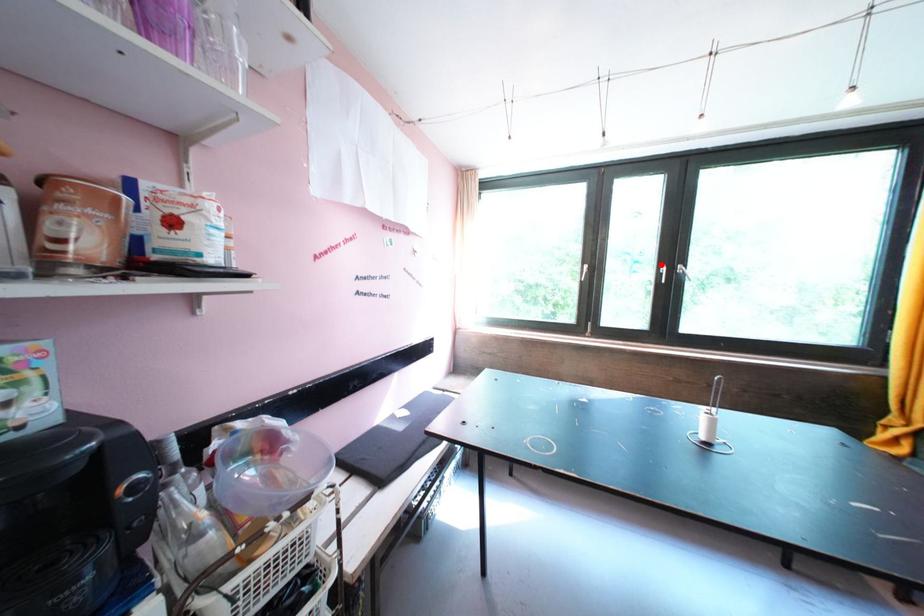
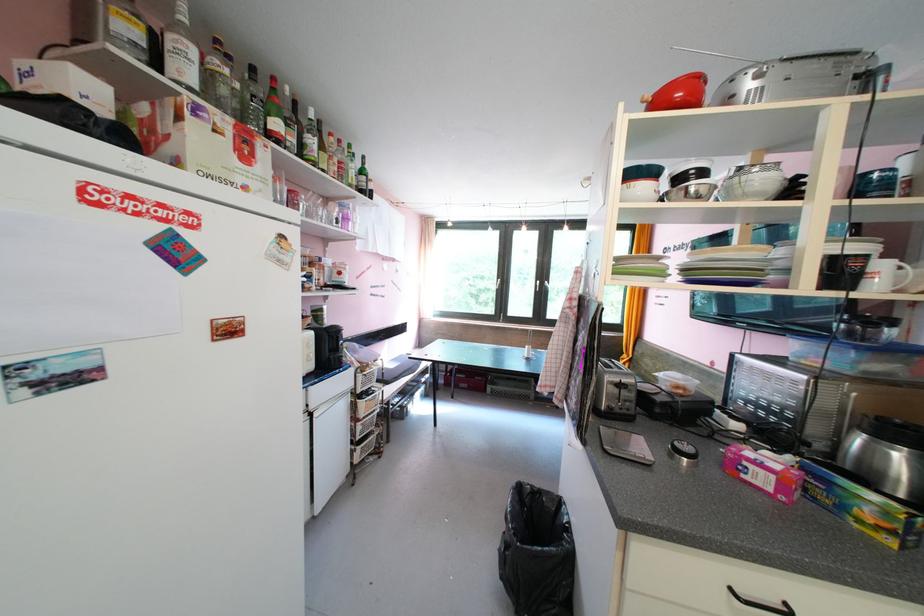
Locate, in the second image, the point that corresponds to the highlighted location in the first image.

(542, 282)